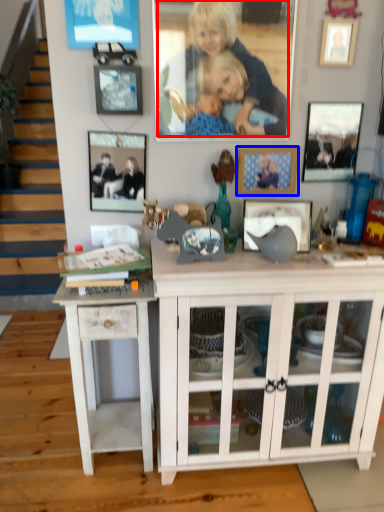
Question: Which object is closer to the camera taking this photo, person (highlighted by a red box) or picture frame (highlighted by a blue box)?

Choices:
 (A) person
 (B) picture frame

Answer: (A)